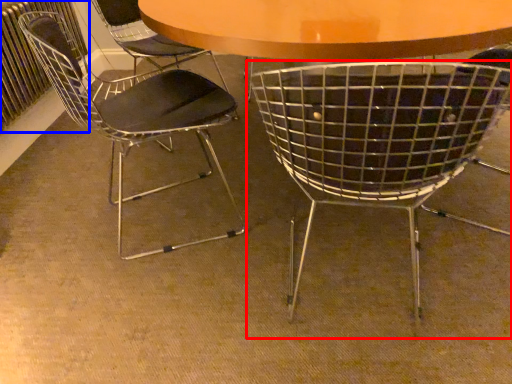
Question: Which of the following is the farthest to the observer, chair (highlighted by a red box) or radiator (highlighted by a blue box)?

Choices:
 (A) chair
 (B) radiator

Answer: (B)